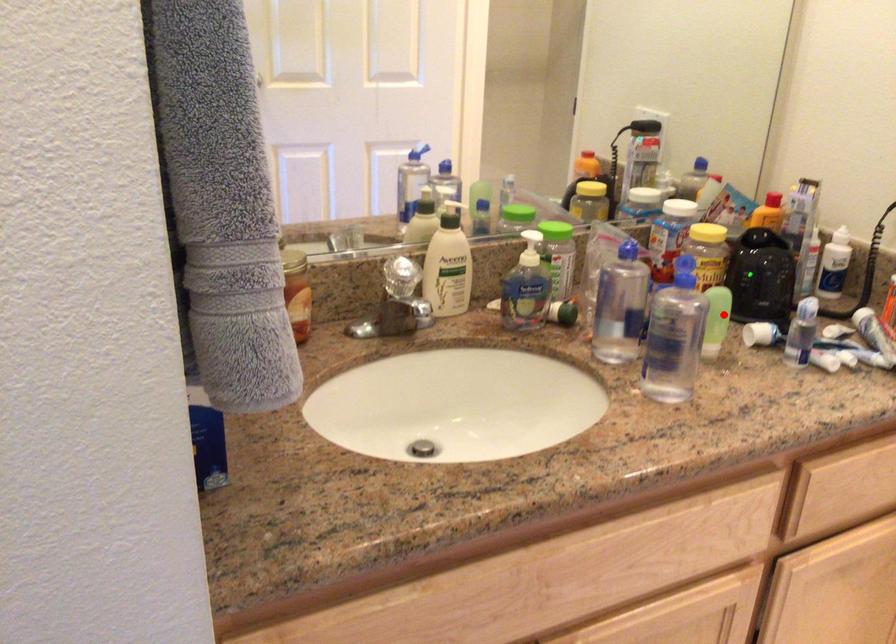
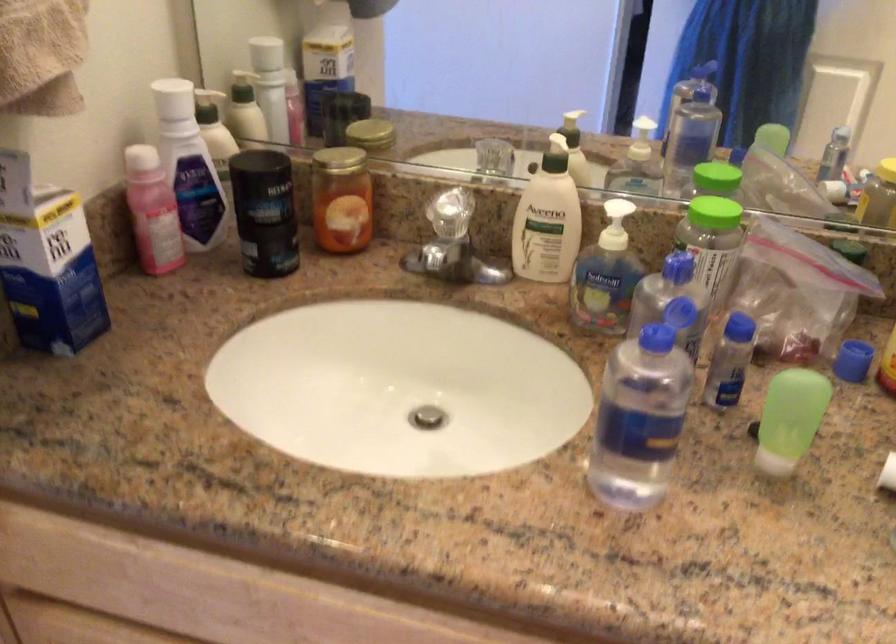
The point at the highlighted location is marked in the first image. Where is the corresponding point in the second image?

(789, 419)